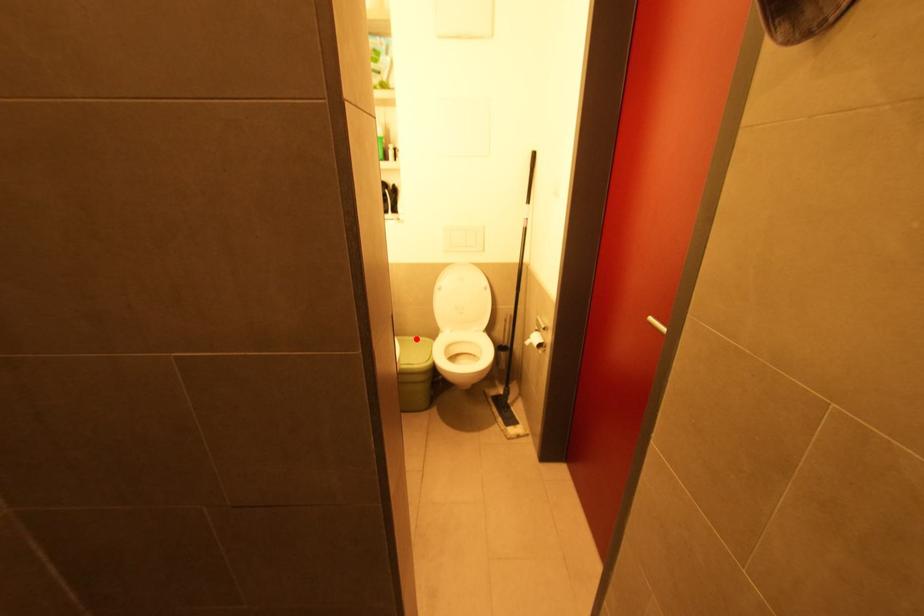
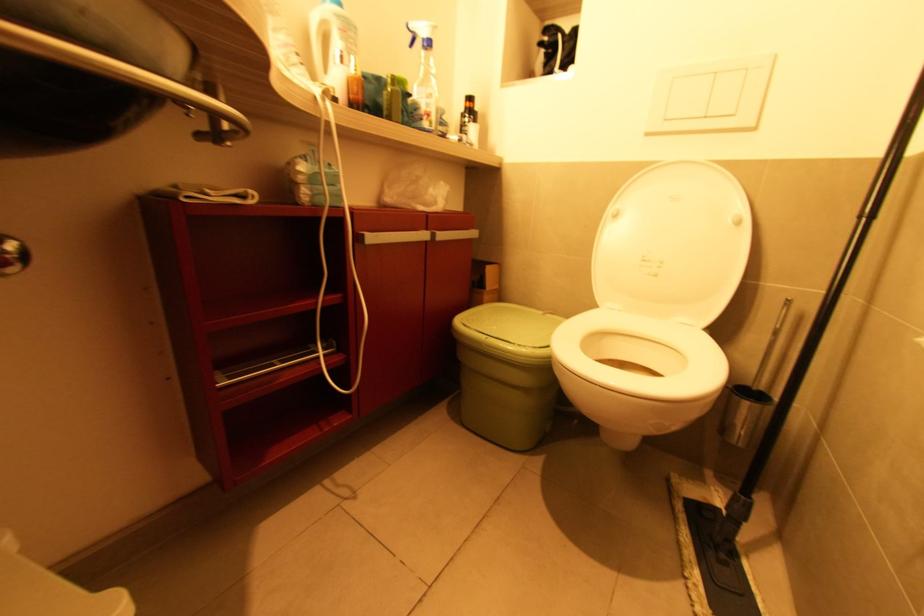
Question: I am providing you with two images of the same scene from different viewpoints. In image1, a red point is highlighted. Considering the same 3D point in image2, which of the following is correct?

Choices:
 (A) It is closer
 (B) It is farther

Answer: (A)